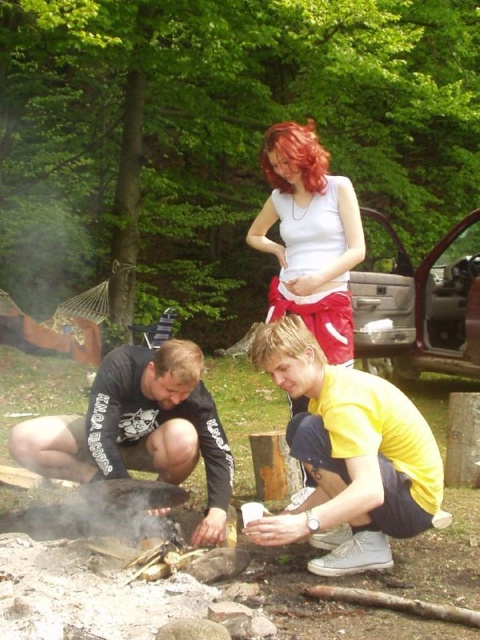
You are a photographer trying to capture a candid shot of the two people at the campfire. You notice the black cotton shirt at center and the white matte tank top at center. Which person should you focus on to ensure the subject is taller in the frame?

The white matte tank top at center is taller than the black cotton shirt at center, so focusing on the person wearing the white matte tank top at center will capture a taller subject in the frame.

Where is the yellow matte shirt at lower center located in the image?

The yellow matte shirt at lower center is located at the 2D coordinates point (348,458) in the image.